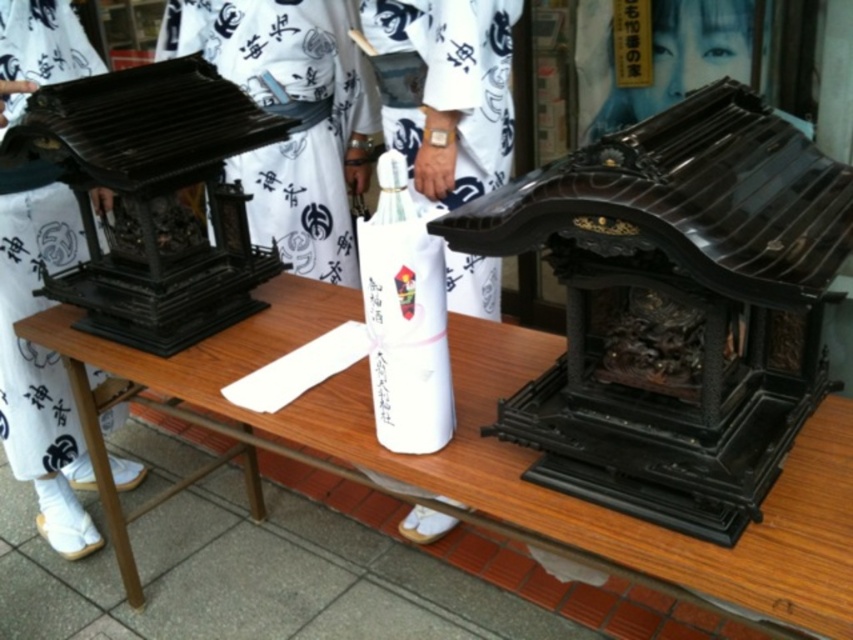
Question: Can you confirm if glossy black shrine at center is smaller than white cotton kimono at center?

Choices:
 (A) no
 (B) yes

Answer: (B)

Question: Is glossy black shrine at center further to the viewer compared to white cotton kimono at center?

Choices:
 (A) yes
 (B) no

Answer: (B)

Question: Which object is positioned farthest from the matte black shrine at left?

Choices:
 (A) wooden table at center
 (B) white cotton kimono at center
 (C) white silk robe at center

Answer: (A)

Question: Observing the image, what is the correct spatial positioning of glossy black shrine at center in reference to matte black shrine at left?

Choices:
 (A) left
 (B) right

Answer: (B)

Question: Which point is closer to the camera?

Choices:
 (A) (503, 115)
 (B) (97, 435)

Answer: (B)

Question: Which of the following is the farthest from the observer?

Choices:
 (A) glossy black shrine at center
 (B) white silk robe at center
 (C) white cotton kimono at center
 (D) matte black shrine at left

Answer: (D)